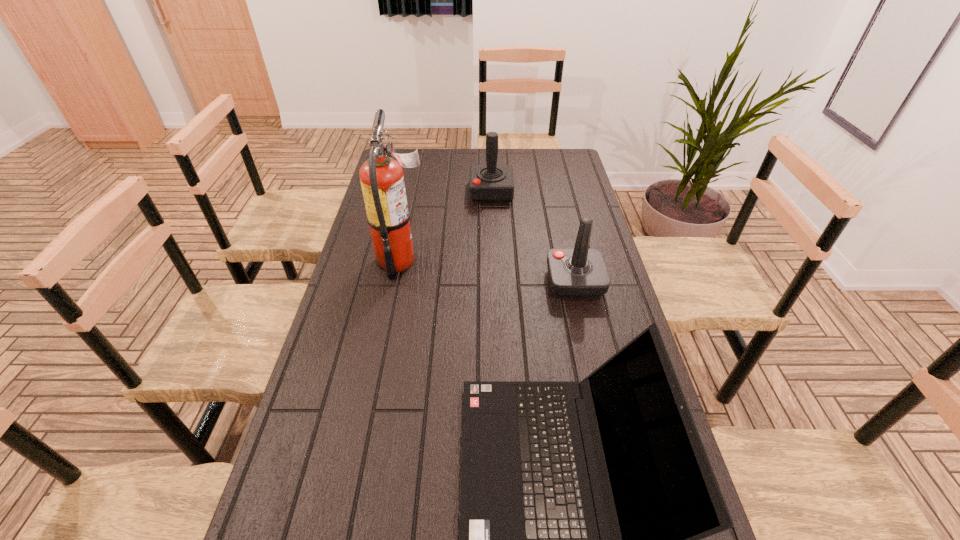
Identify the location of empty space that is in between the farther joystick and the leftmost object. This screenshot has height=540, width=960. (446, 226).

Where is `object that stands as the third closest to the tallest object`? object that stands as the third closest to the tallest object is located at coordinates (528, 539).

Locate an element on the screen. Image resolution: width=960 pixels, height=540 pixels. the third closest object relative to the right joystick is located at coordinates (382, 181).

The image size is (960, 540). What are the coordinates of `vacant space that satisfies the following two spatial constraints: 1. from the nozzle of the tallest object; 2. on the right side of the nearer joystick` in the screenshot? It's located at (397, 283).

This screenshot has width=960, height=540. In order to click on free space that satisfies the following two spatial constraints: 1. on the back side of the nearer joystick; 2. on the base of the farthest object in this screenshot , I will do `click(554, 192)`.

The width and height of the screenshot is (960, 540). Find the location of `vacant region that satisfies the following two spatial constraints: 1. on the base of the farthest object; 2. on the left side of the right joystick`. vacant region that satisfies the following two spatial constraints: 1. on the base of the farthest object; 2. on the left side of the right joystick is located at coordinates (494, 283).

This screenshot has width=960, height=540. Find the location of `vacant region that satisfies the following two spatial constraints: 1. from the nozzle of the fire extinguisher; 2. on the back side of the right joystick`. vacant region that satisfies the following two spatial constraints: 1. from the nozzle of the fire extinguisher; 2. on the back side of the right joystick is located at coordinates (397, 283).

I want to click on free point that satisfies the following two spatial constraints: 1. from the nozzle of the fire extinguisher; 2. on the right side of the right joystick, so click(x=397, y=283).

The width and height of the screenshot is (960, 540). I want to click on vacant space that satisfies the following two spatial constraints: 1. from the nozzle of the nearer joystick; 2. on the right side of the leftmost object, so point(397,283).

Find the location of a particular element. Image resolution: width=960 pixels, height=540 pixels. vacant region that satisfies the following two spatial constraints: 1. from the nozzle of the fire extinguisher; 2. on the back side of the nearer joystick is located at coordinates (397, 283).